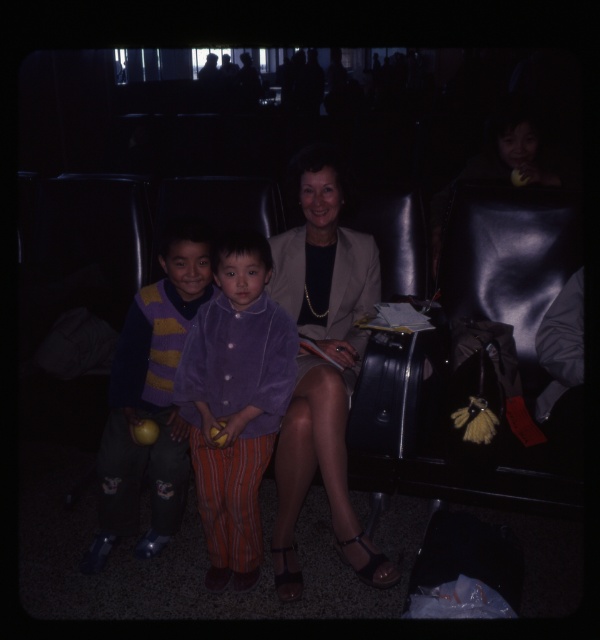
Question: Which of the following is the farthest from the observer?

Choices:
 (A) (280, 353)
 (B) (352, 332)

Answer: (B)

Question: Is purple fleece jacket at center thinner than striped sweater at center?

Choices:
 (A) no
 (B) yes

Answer: (B)

Question: Considering the relative positions of purple fleece jacket at center and striped sweater at center in the image provided, where is purple fleece jacket at center located with respect to striped sweater at center?

Choices:
 (A) left
 (B) right

Answer: (B)

Question: Which point is farther to the camera?

Choices:
 (A) striped sweater at center
 (B) purple fleece jacket at center

Answer: (A)

Question: Which object is positioned closest to the matte beige blazer at center?

Choices:
 (A) striped sweater at center
 (B) purple fleece jacket at center

Answer: (B)

Question: Does matte beige blazer at center have a lesser width compared to purple fleece jacket at center?

Choices:
 (A) yes
 (B) no

Answer: (B)